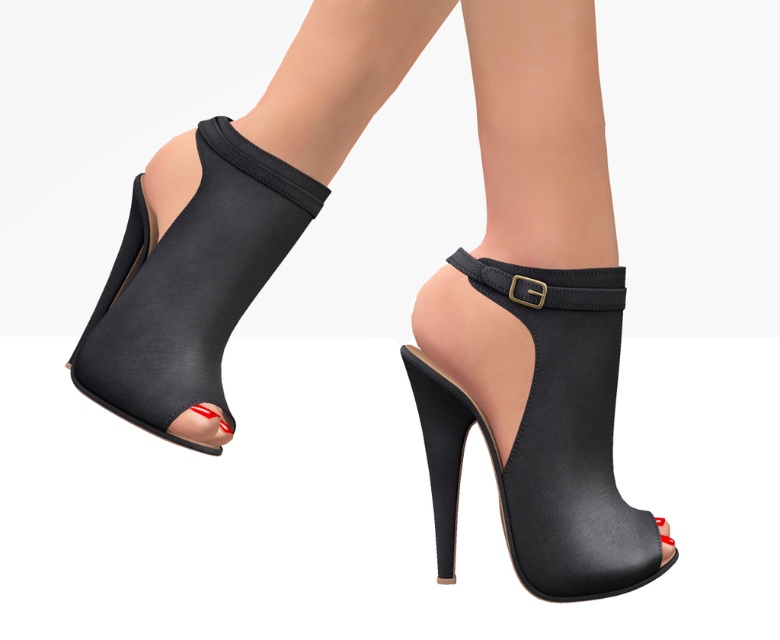
You are a photographer adjusting your camera to focus on two points on the high heels. The first point is at point (232, 291) and the second is at point (519, 468). Which point should you focus on first if you want to capture the closest point to the camera?

Point (232, 291) is further to the camera than point (519, 468), so you should focus on point (232, 291) first as it is closer to the camera.